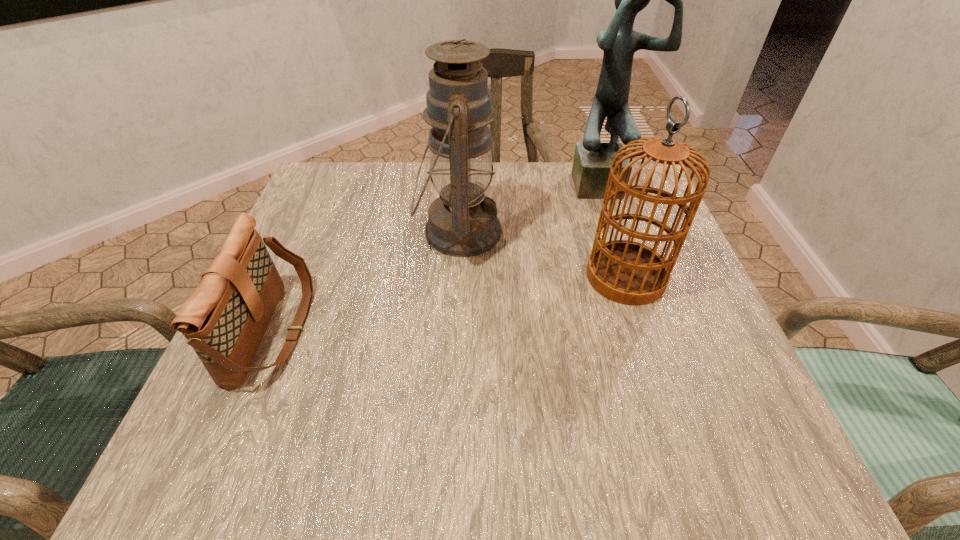
Locate an element on the screen. The width and height of the screenshot is (960, 540). free space at the near left corner of the desktop is located at coordinates (259, 444).

Locate an element on the screen. This screenshot has width=960, height=540. vacant space in between the sculpture and the shoulder bag is located at coordinates (438, 256).

The height and width of the screenshot is (540, 960). Identify the location of free space between the oil lamp and the birdcage. (542, 254).

The height and width of the screenshot is (540, 960). I want to click on free area in between the oil lamp and the sculpture, so click(530, 207).

Where is `vacant region between the oil lamp and the shoulder bag`? The image size is (960, 540). vacant region between the oil lamp and the shoulder bag is located at coordinates (366, 281).

The height and width of the screenshot is (540, 960). In order to click on unoccupied area between the sculpture and the leftmost object in this screenshot , I will do `click(438, 256)`.

This screenshot has height=540, width=960. What are the coordinates of `free space between the leftmost object and the oil lamp` in the screenshot? It's located at (366, 281).

The image size is (960, 540). I want to click on the third closest object relative to the oil lamp, so (x=592, y=161).

This screenshot has height=540, width=960. Find the location of `the second closest object to the second object from left to right`. the second closest object to the second object from left to right is located at coordinates (224, 319).

You are a GUI agent. You are given a task and a screenshot of the screen. Output one action in this format:
    pyautogui.click(x=<x>, y=<y>)
    Task: Click on the free space that satisfies the following two spatial constraints: 1. on the front side of the oil lamp; 2. on the left side of the birdcage
    The height and width of the screenshot is (540, 960).
    Given the screenshot: What is the action you would take?
    pyautogui.click(x=456, y=276)